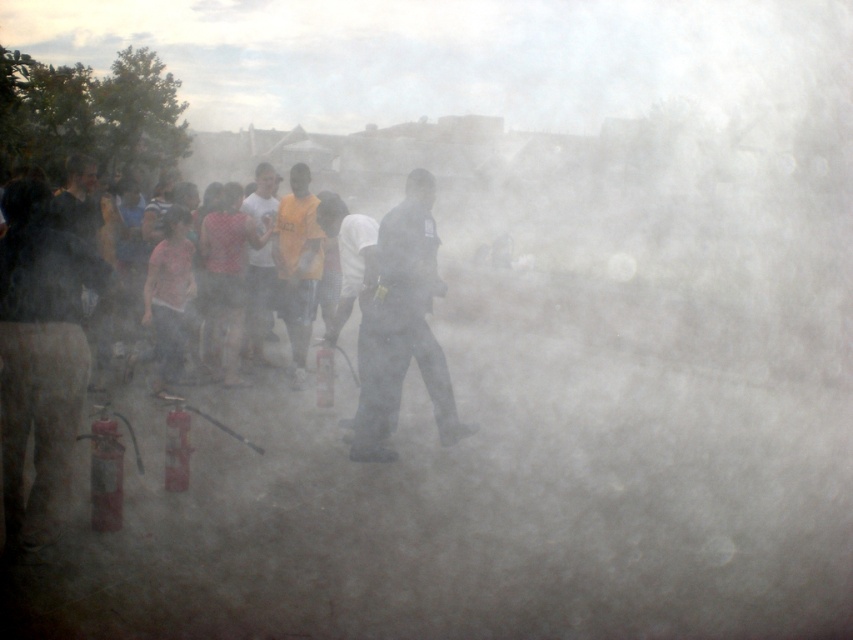
Is point (450, 396) less distant than point (265, 289)?

That is True.

Between dark uniformed figure at center and white matte shirt at center, which one has less height?

white matte shirt at center is shorter.

Identify the location of dark uniformed figure at center. The width and height of the screenshot is (853, 640). (402, 326).